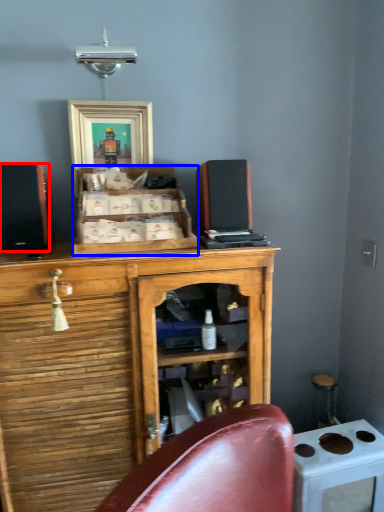
Question: Among these objects, which one is nearest to the camera, speaker (highlighted by a red box) or cabinetry (highlighted by a blue box)?

Choices:
 (A) speaker
 (B) cabinetry

Answer: (B)